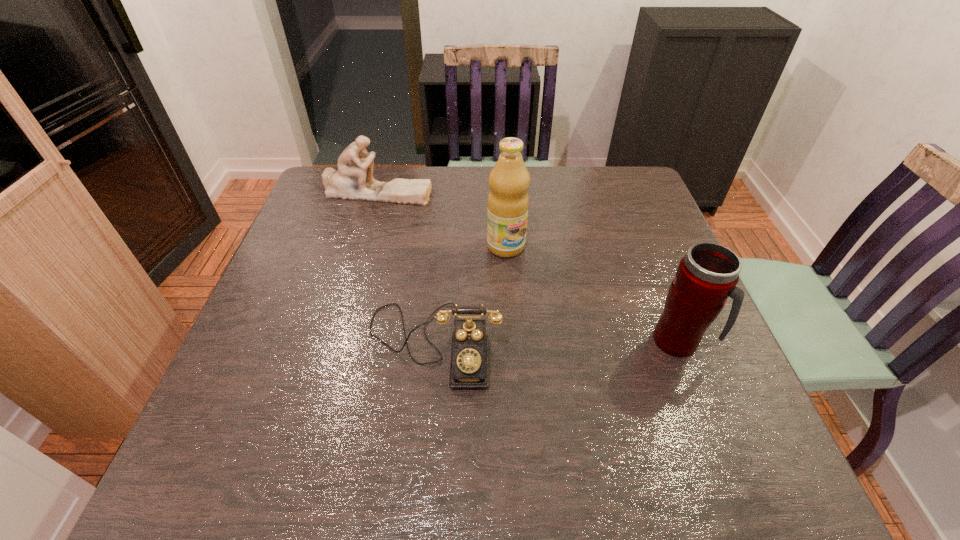
Where is `vacant space on the desktop that is between the shortest object and the thermos bottle and is positioned on the label of the olive oil`? Image resolution: width=960 pixels, height=540 pixels. vacant space on the desktop that is between the shortest object and the thermos bottle and is positioned on the label of the olive oil is located at coordinates (587, 342).

This screenshot has width=960, height=540. In order to click on vacant space on the desktop that is between the telephone and the second tallest object and is positioned on the front-facing side of the figurine in this screenshot , I will do `click(540, 343)`.